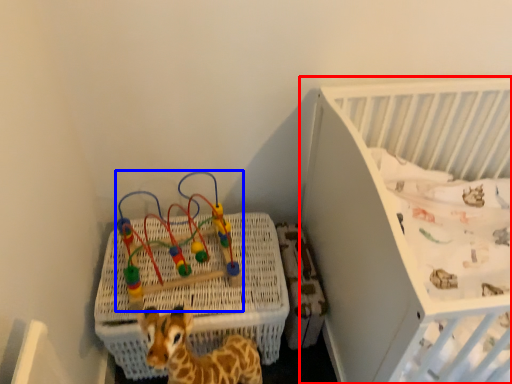
Question: Which point is closer to the camera, infant bed (highlighted by a red box) or toy (highlighted by a blue box)?

Choices:
 (A) infant bed
 (B) toy

Answer: (A)